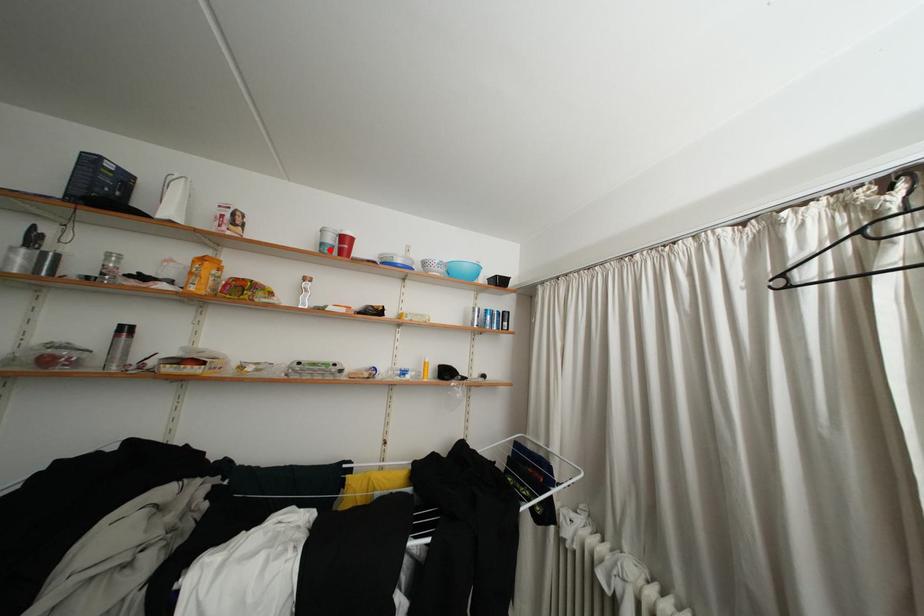
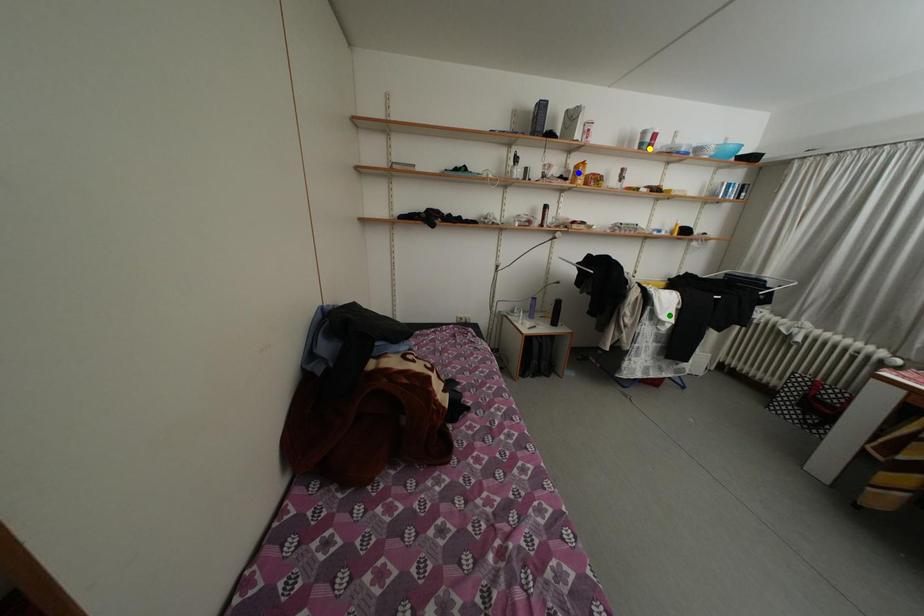
Question: I am providing you with two images of the same scene from different viewpoints. A red point is marked on the first image. You are given multiple points on the second image. Which point in image 2 is actually the same real-world point as the red point in image 1?

Choices:
 (A) yellow point
 (B) green point
 (C) blue point

Answer: (A)